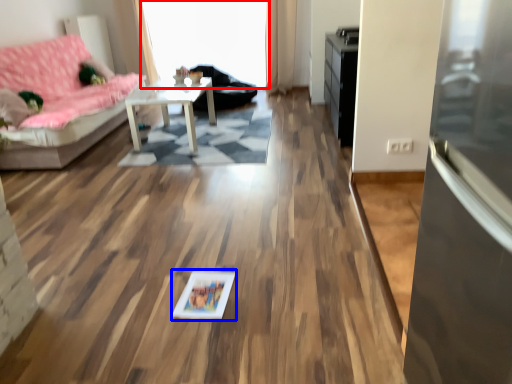
Question: Which of the following is the farthest to the observer, window screen (highlighted by a red box) or picture frame (highlighted by a blue box)?

Choices:
 (A) window screen
 (B) picture frame

Answer: (A)